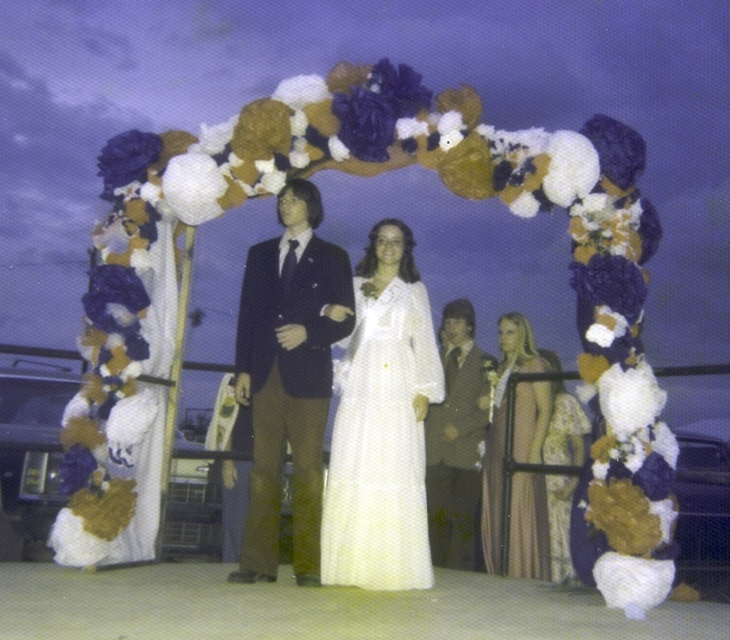
You are a photographer at the event and want to position yourself directly in front of the white satin dress at center to capture the best angle. Given that the coordinate system starts at the bottom left corner of the image, what are the coordinates where you should stand?

The white satin dress at center is located at coordinates point (380,428), so you should position yourself directly in front of it at those coordinates to capture the best angle.

From the picture: You are a photographer at the event and want to capture a photo where both the white satin dress at center and the silky gold dress at center are clearly visible. Which dress should you focus on first to ensure the other is also in frame?

The white satin dress at center is positioned on the left side of silky gold dress at center, so focusing on the silky gold dress at center first would naturally include the white satin dress at center in the frame since it is to the left.